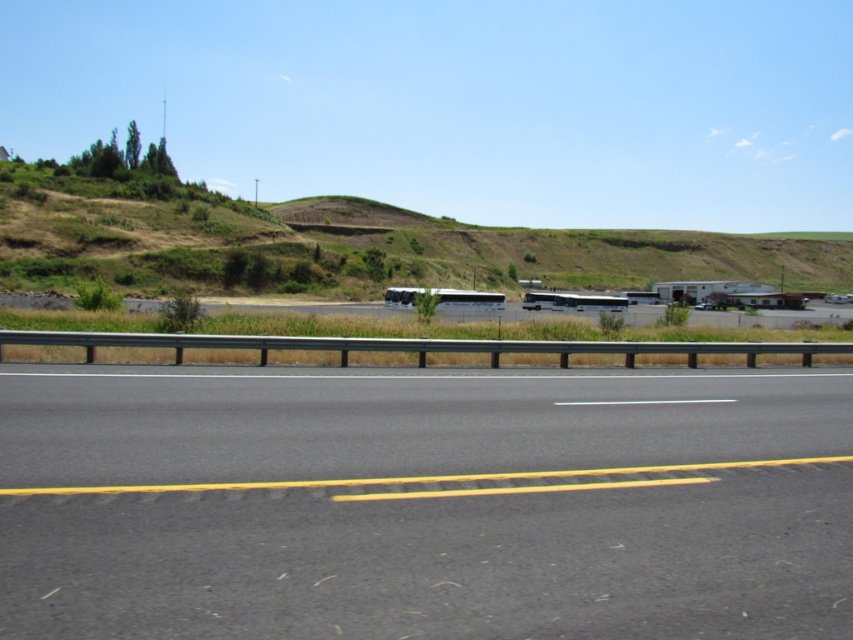
You are a tour guide planning to move the metallic silver recreational vehicle at center closer to the metallic silver bus at center. If the parking lot has a maximum allowed distance of 30 feet between vehicles for safety, is the current distance compliant with the safety regulation?

The metallic silver recreational vehicle at center is 31.57 feet away from the metallic silver bus at center. Since the required maximum distance is 30 feet, the current distance exceeds the safety regulation by 1.57 feet. Therefore, the vehicles are not compliant with the safety regulation and need to be moved closer.

You are a tour guide planning to move the metallic silver recreational vehicle at center and the metallic silver bus at center from the parking lot to a nearby service area. The service area has a narrow entrance that only allows vehicles shorter than 20 feet. Based on the scene description, can both vehicles fit through the entrance?

The metallic silver recreational vehicle at center is smaller than the metallic silver bus at center. However, the exact dimensions of each vehicle are not provided. Without knowing their specific lengths, it is impossible to determine if they can fit through the 20 feet entrance.